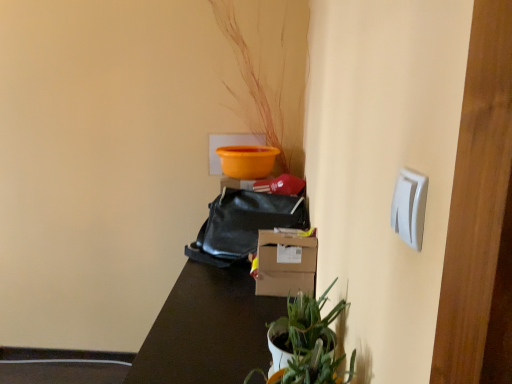
You are a GUI agent. You are given a task and a screenshot of the screen. Output one action in this format:
    pyautogui.click(x=<x>, y=<y>)
    Task: Click on the white plastic light switch at upper right
    The width and height of the screenshot is (512, 384).
    Given the screenshot: What is the action you would take?
    [x=409, y=207]

Where is `white plastic light switch at upper right`? This screenshot has width=512, height=384. white plastic light switch at upper right is located at coordinates (409, 207).

From a real-world perspective, which object stands above the other?

white plastic light switch at upper right is physically above.

From the image's perspective, is white plastic light switch at upper right positioned above or below green matte plant at lower center?

white plastic light switch at upper right is above green matte plant at lower center.

Is white plastic light switch at upper right smaller than green matte plant at lower center?

Yes.

Does point (392, 216) come farther from viewer compared to point (284, 344)?

No, it is in front of (284, 344).

From the image's perspective, which one is positioned lower, brown matte table at center or green matte plant at lower center?

brown matte table at center appears lower in the image.

Is brown matte table at center looking in the opposite direction of green matte plant at lower center?

No, green matte plant at lower center is not at the back of brown matte table at center.

Where is `table behind the green matte plant at lower center`? The image size is (512, 384). table behind the green matte plant at lower center is located at coordinates (208, 329).

Is brown matte table at center wider than green matte plant at lower center?

Yes.

Would you say brown matte table at center contains black leather bag at center?

No, black leather bag at center is not surrounded by brown matte table at center.

How different are the orientations of brown matte table at center and black leather bag at center in degrees?

64.9 degrees separate the facing orientations of brown matte table at center and black leather bag at center.

Is brown matte table at center not close to black leather bag at center?

That's not correct — brown matte table at center is a little close to black leather bag at center.

Considering the sizes of objects brown matte table at center and black leather bag at center in the image provided, who is taller, brown matte table at center or black leather bag at center?

brown matte table at center.

From a real-world perspective, is brown matte table at center physically located above or below white plastic light switch at upper right?

brown matte table at center is situated lower than white plastic light switch at upper right in the real world.

Can you tell me how much brown matte table at center and white plastic light switch at upper right differ in facing direction?

0.683 degrees.

Which of these two, brown matte table at center or white plastic light switch at upper right, is smaller?

white plastic light switch at upper right.

Is white plastic light switch at upper right in front of or behind black leather bag at center in the image?

white plastic light switch at upper right is in front of black leather bag at center.

Is black leather bag at center at the back of white plastic light switch at upper right?

No, white plastic light switch at upper right is not facing away from black leather bag at center.

Does white plastic light switch at upper right have a smaller size compared to black leather bag at center?

Yes.

Is black leather bag at center positioned behind green matte plant at lower center?

Yes, black leather bag at center is further from the viewer.

Image resolution: width=512 pixels, height=384 pixels. Find the location of `houseplant in front of the black leather bag at center`. houseplant in front of the black leather bag at center is located at coordinates (307, 343).

Is black leather bag at center not inside green matte plant at lower center?

Yes.

Which point is more distant from viewer, (214, 247) or (328, 350)?

The point (214, 247) is behind.

Does black leather bag at center come behind white plastic light switch at upper right?

Yes, it is.

Is black leather bag at center inside or outside of white plastic light switch at upper right?

The correct answer is: outside.

Is black leather bag at center taller than white plastic light switch at upper right?

Correct, black leather bag at center is much taller as white plastic light switch at upper right.

Is black leather bag at center far from white plastic light switch at upper right?

That's right, there is a large distance between black leather bag at center and white plastic light switch at upper right.

This screenshot has width=512, height=384. I want to click on light switch on the right of green matte plant at lower center, so click(409, 207).

Identify the location of table behind the green matte plant at lower center. (208, 329).

Looking at the image, which one is located closer to green matte plant at lower center, black leather bag at center or brown matte table at center?

Result: brown matte table at center lies closer to green matte plant at lower center than the other object.

From the image, which object appears to be nearer to brown matte table at center, green matte plant at lower center or black leather bag at center?

black leather bag at center is closer to brown matte table at center.

When comparing their distances from black leather bag at center, does brown matte table at center or white plastic light switch at upper right seem closer?

brown matte table at center.

Estimate the real-world distances between objects in this image. Which object is further from white plastic light switch at upper right, black leather bag at center or green matte plant at lower center?

black leather bag at center is positioned further to the anchor white plastic light switch at upper right.

When comparing their distances from green matte plant at lower center, does white plastic light switch at upper right or brown matte table at center seem closer?

brown matte table at center is closer to green matte plant at lower center.

Which object lies nearer to the anchor point brown matte table at center, black leather bag at center or green matte plant at lower center?

The object closer to brown matte table at center is black leather bag at center.

Looking at the image, which one is located further to black leather bag at center, green matte plant at lower center or white plastic light switch at upper right?

white plastic light switch at upper right.

When comparing their distances from brown matte table at center, does white plastic light switch at upper right or black leather bag at center seem closer?

Based on the image, black leather bag at center appears to be nearer to brown matte table at center.

Identify the location of table located between green matte plant at lower center and black leather bag at center in the depth direction. (x=208, y=329).

Identify the location of table positioned between white plastic light switch at upper right and black leather bag at center from near to far. (208, 329).

Where is `houseplant positioned between white plastic light switch at upper right and black leather bag at center from near to far`? Image resolution: width=512 pixels, height=384 pixels. houseplant positioned between white plastic light switch at upper right and black leather bag at center from near to far is located at coordinates (307, 343).

At what (x,y) coordinates should I click in order to perform the action: click on houseplant between white plastic light switch at upper right and brown matte table at center in the vertical direction. Please return your answer as a coordinate pair (x, y). This screenshot has height=384, width=512. Looking at the image, I should click on (307, 343).